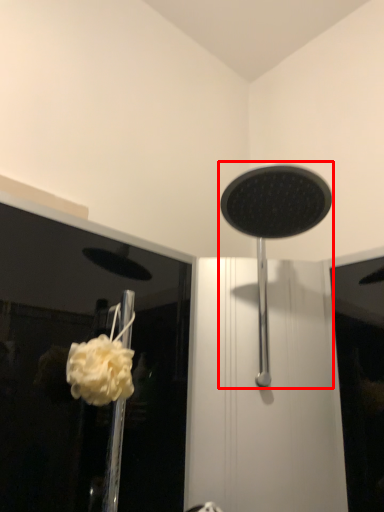
Question: From the image's perspective, where is shower (annotated by the red box) located relative to flower?

Choices:
 (A) below
 (B) above

Answer: (B)